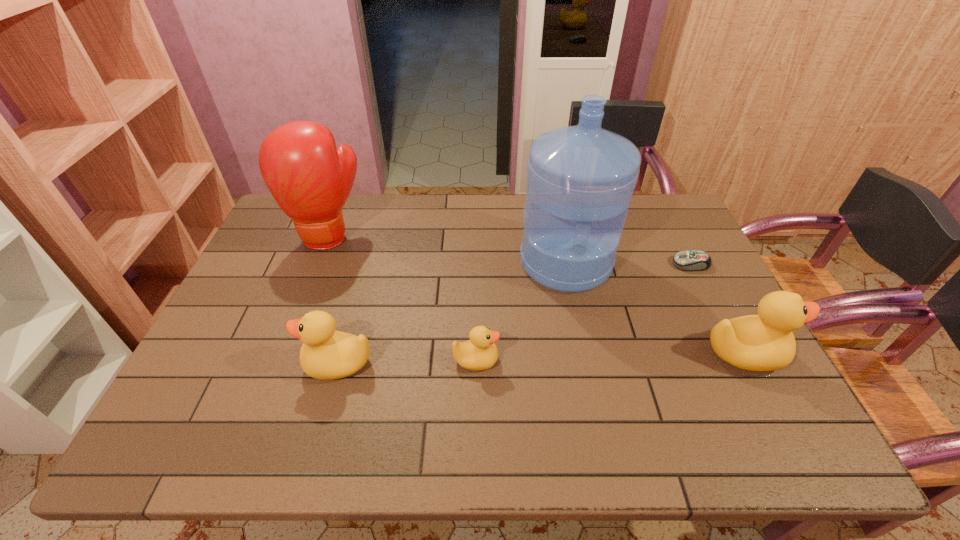
Identify the location of free space between the shortest object and the boxing glove. (510, 251).

The width and height of the screenshot is (960, 540). What are the coordinates of `object that ranks as the third closest to the water jug` in the screenshot? It's located at (765, 342).

Locate an element on the screen. Image resolution: width=960 pixels, height=540 pixels. object that is the fourth closest to the third object from left to right is located at coordinates (765, 342).

Locate which duck is the second closest to the computer mouse. Please provide its 2D coordinates. Your answer should be formatted as a tuple, i.e. [(x, y)], where the tuple contains the x and y coordinates of a point satisfying the conditions above.

[(479, 353)]

Locate an element on the screen. This screenshot has width=960, height=540. duck that stands as the second closest to the second tallest duck is located at coordinates (765, 342).

I want to click on vacant region that satisfies the following two spatial constraints: 1. on the side of the water jug with the handle; 2. at the beak of the second shortest duck, so click(x=587, y=363).

The image size is (960, 540). Find the location of `free space that satisfies the following two spatial constraints: 1. on the side of the fourth object from left to right with the handle; 2. at the beak of the second duck from left to right`. free space that satisfies the following two spatial constraints: 1. on the side of the fourth object from left to right with the handle; 2. at the beak of the second duck from left to right is located at coordinates (586, 360).